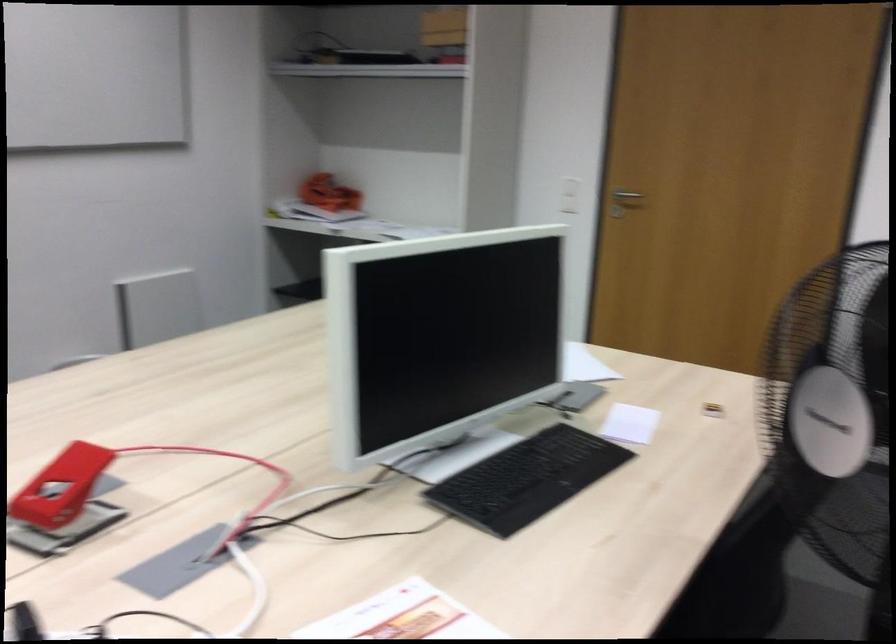
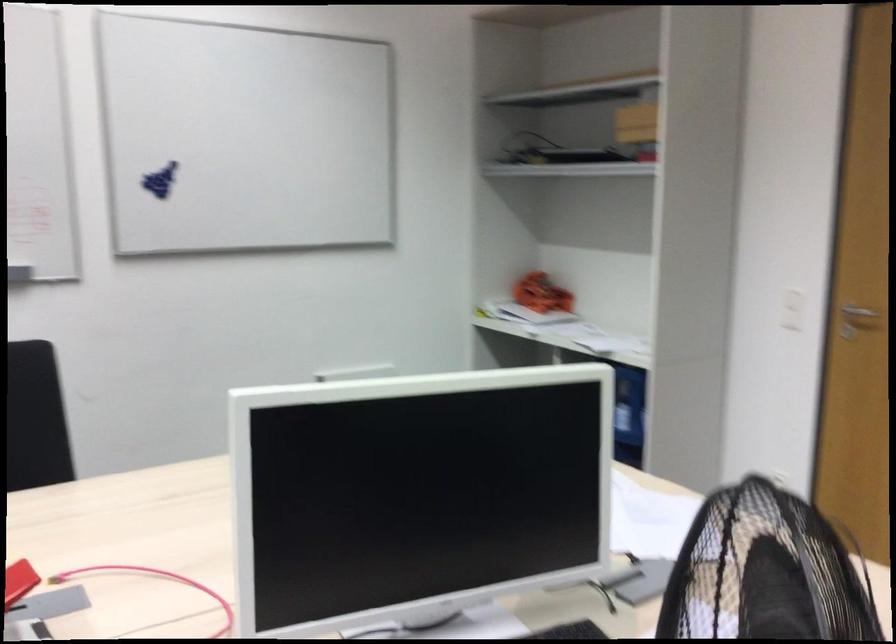
Question: The camera is either moving clockwise (left) or counter-clockwise (right) around the object. The first image is from the beginning of the video and the second image is from the end. Is the camera moving left or right when shooting the video?

Choices:
 (A) Left
 (B) Right

Answer: (B)